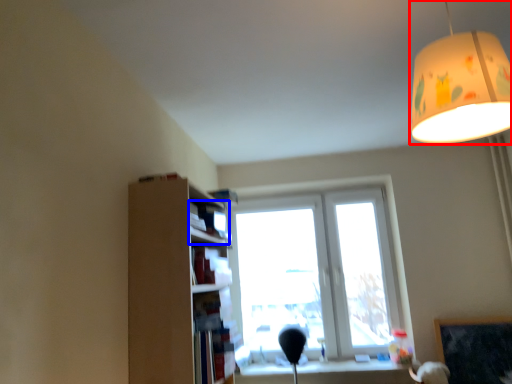
Question: Which object is further to the camera taking this photo, lamp (highlighted by a red box) or book (highlighted by a blue box)?

Choices:
 (A) lamp
 (B) book

Answer: (B)